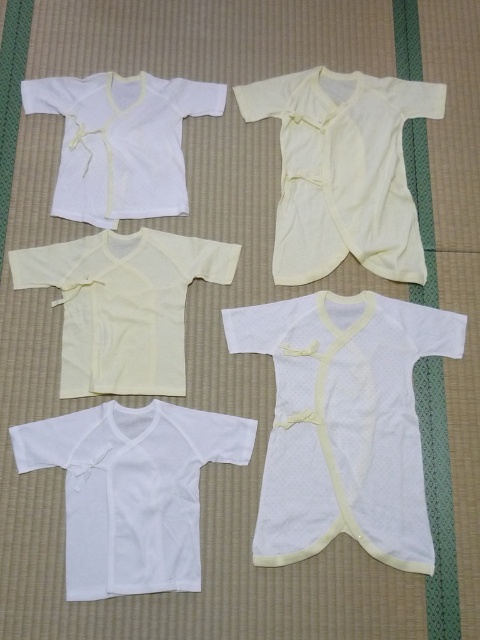
Where is `white soft fabric baby gown at center`? white soft fabric baby gown at center is located at coordinates (344, 422).

Is white soft fabric baby gown at center thinner than white matte t-shirt at lower left?

No.

The image size is (480, 640). Identify the location of white soft fabric baby gown at center. (344, 422).

You are a GUI agent. You are given a task and a screenshot of the screen. Output one action in this format:
    pyautogui.click(x=<x>, y=<y>)
    Task: Click on the white soft fabric baby gown at center
    
    Given the screenshot: What is the action you would take?
    pyautogui.click(x=344, y=422)

Can you confirm if creamy yellow knit onesie at upper center is positioned to the left of white cotton shirt at upper left?

Incorrect, creamy yellow knit onesie at upper center is not on the left side of white cotton shirt at upper left.

The image size is (480, 640). In order to click on creamy yellow knit onesie at upper center in this screenshot , I will do `click(343, 170)`.

In order to click on creamy yellow knit onesie at upper center in this screenshot , I will do `click(343, 170)`.

Where is `creamy yellow knit onesie at upper center`? Image resolution: width=480 pixels, height=640 pixels. creamy yellow knit onesie at upper center is located at coordinates (343, 170).

Does point (336, 92) come farther from viewer compared to point (132, 340)?

Yes.

Identify the location of creamy yellow knit onesie at upper center. (343, 170).